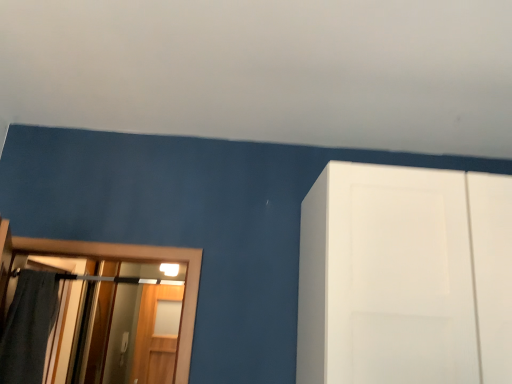
Question: Considering the positions of point pos(153,360) and point pos(45,342), is point pos(153,360) closer or farther from the camera than point pos(45,342)?

Choices:
 (A) closer
 (B) farther

Answer: (B)

Question: From a real-world perspective, is wooden screen door at left positioned above or below dark gray fabric bath towel at left?

Choices:
 (A) below
 (B) above

Answer: (A)

Question: Is wooden screen door at left situated inside dark gray fabric bath towel at left or outside?

Choices:
 (A) inside
 (B) outside

Answer: (B)

Question: Is dark gray fabric bath towel at left taller or shorter than wooden screen door at left?

Choices:
 (A) tall
 (B) short

Answer: (B)

Question: Is dark gray fabric bath towel at left spatially inside wooden screen door at left, or outside of it?

Choices:
 (A) inside
 (B) outside

Answer: (B)

Question: Considering the positions of dark gray fabric bath towel at left and wooden screen door at left in the image, is dark gray fabric bath towel at left bigger or smaller than wooden screen door at left?

Choices:
 (A) big
 (B) small

Answer: (B)

Question: Considering the positions of dark gray fabric bath towel at left and wooden screen door at left in the image, is dark gray fabric bath towel at left wider or thinner than wooden screen door at left?

Choices:
 (A) wide
 (B) thin

Answer: (A)